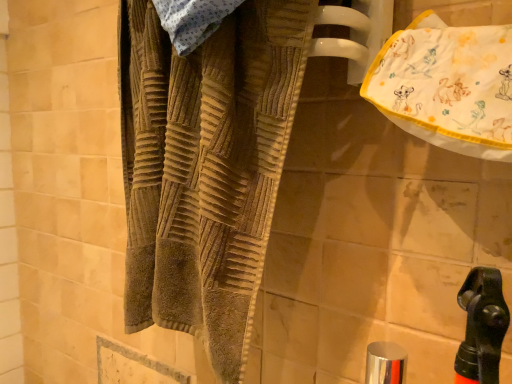
Question: From the image's perspective, is silver metallic faucet at lower center on brown textured towel at center?

Choices:
 (A) yes
 (B) no

Answer: (B)

Question: Considering the relative positions of silver metallic faucet at lower center and brown textured towel at center in the image provided, is silver metallic faucet at lower center behind brown textured towel at center?

Choices:
 (A) no
 (B) yes

Answer: (B)

Question: Is silver metallic faucet at lower center oriented away from brown textured towel at center?

Choices:
 (A) yes
 (B) no

Answer: (B)

Question: Can you confirm if silver metallic faucet at lower center is bigger than brown textured towel at center?

Choices:
 (A) yes
 (B) no

Answer: (B)

Question: Does silver metallic faucet at lower center have a lesser height compared to brown textured towel at center?

Choices:
 (A) yes
 (B) no

Answer: (A)

Question: Is silver metallic faucet at lower center next to brown textured towel at center and touching it?

Choices:
 (A) no
 (B) yes

Answer: (A)

Question: Is white cotton towel at upper right next to silver metallic faucet at lower center?

Choices:
 (A) no
 (B) yes

Answer: (A)

Question: Does white cotton towel at upper right come in front of silver metallic faucet at lower center?

Choices:
 (A) no
 (B) yes

Answer: (B)

Question: Is white cotton towel at upper right thinner than silver metallic faucet at lower center?

Choices:
 (A) no
 (B) yes

Answer: (A)

Question: Does white cotton towel at upper right appear on the right side of silver metallic faucet at lower center?

Choices:
 (A) yes
 (B) no

Answer: (A)

Question: Is white cotton towel at upper right oriented towards silver metallic faucet at lower center?

Choices:
 (A) no
 (B) yes

Answer: (A)

Question: From a real-world perspective, is white cotton towel at upper right below silver metallic faucet at lower center?

Choices:
 (A) no
 (B) yes

Answer: (A)

Question: Does brown textured towel at center turn towards white cotton towel at upper right?

Choices:
 (A) yes
 (B) no

Answer: (B)